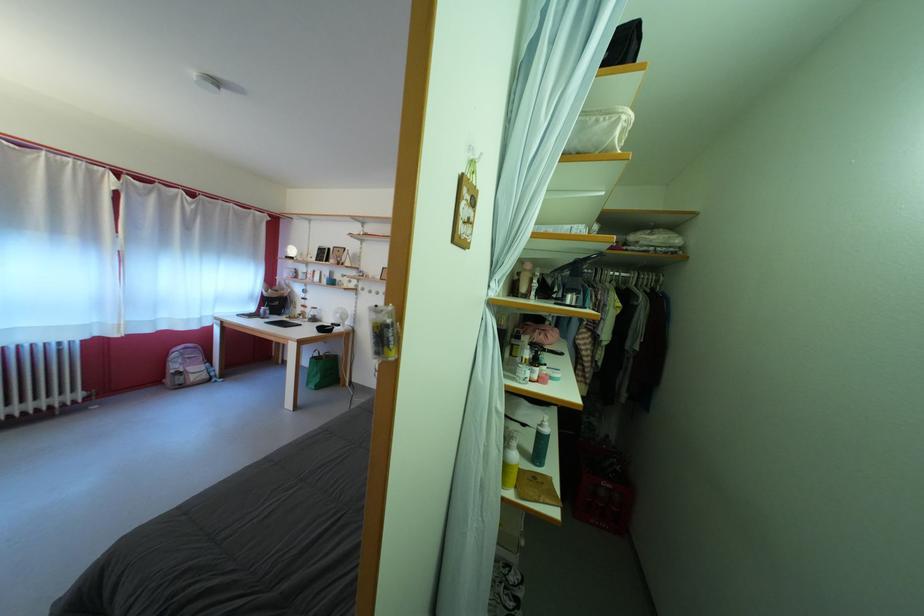
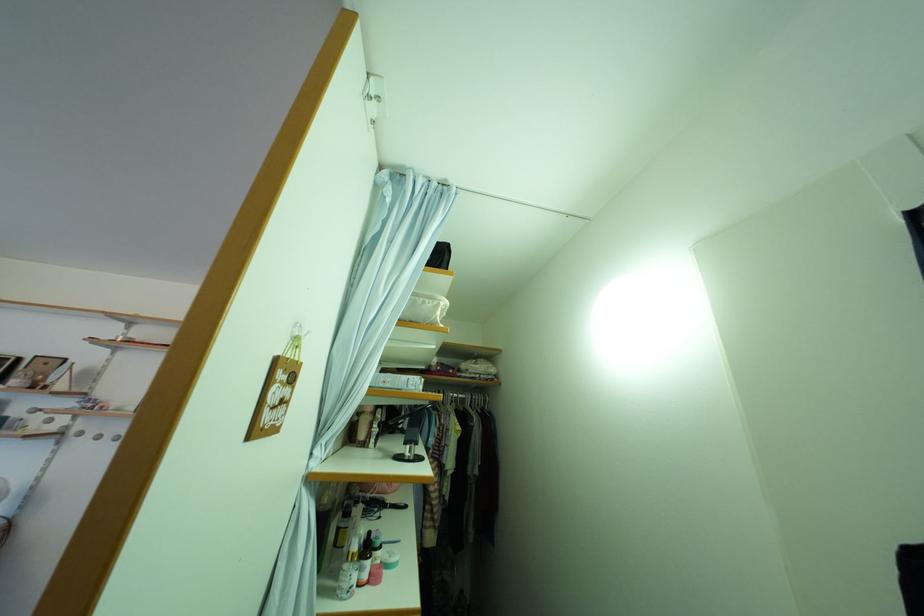
Where in the second image is the point corresponding to point (605, 128) from the first image?

(432, 309)